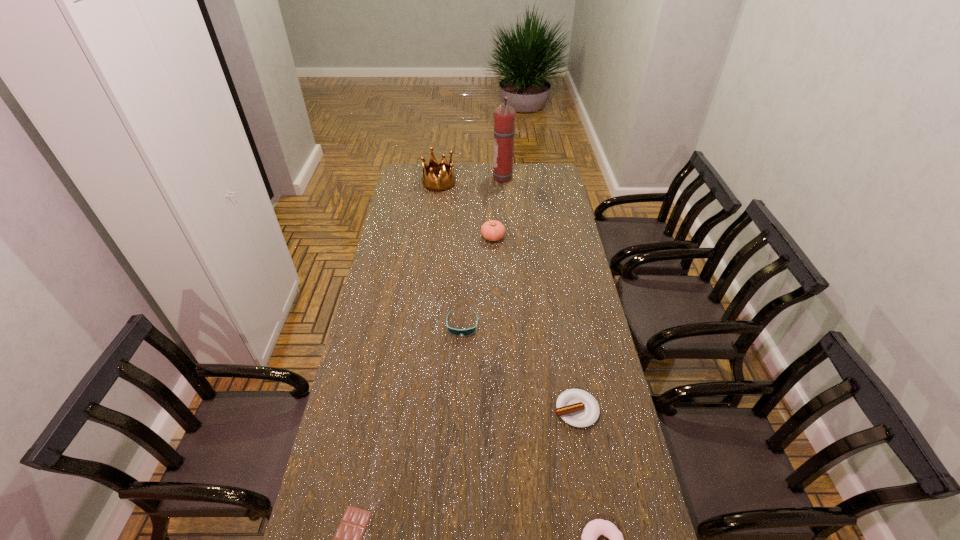
You are a GUI agent. You are given a task and a screenshot of the screen. Output one action in this format:
    pyautogui.click(x=<x>, y=<y>)
    Task: Click on the free region located on the right of the crown
    The height and width of the screenshot is (540, 960).
    Given the screenshot: What is the action you would take?
    pyautogui.click(x=526, y=183)

You are a GUI agent. You are given a task and a screenshot of the screen. Output one action in this format:
    pyautogui.click(x=<x>, y=<y>)
    Task: Click on the vacant space located on the front of the tomato
    
    Given the screenshot: What is the action you would take?
    pyautogui.click(x=495, y=305)

Find the location of a particular element. This screenshot has height=540, width=960. vacant area located 0.270m on the front-facing side of the sunglasses is located at coordinates (459, 404).

The image size is (960, 540). I want to click on free space located 0.170m on the back of the fifth farthest object, so click(x=565, y=349).

This screenshot has width=960, height=540. I want to click on fire extinguisher situated at the far edge, so click(504, 116).

Where is `crown present at the far edge`? The height and width of the screenshot is (540, 960). crown present at the far edge is located at coordinates (446, 180).

Where is `object located in the left edge section of the desktop`? Image resolution: width=960 pixels, height=540 pixels. object located in the left edge section of the desktop is located at coordinates (446, 180).

Find the location of a particular element. The image size is (960, 540). object that is at the right edge is located at coordinates tap(578, 408).

Locate an element on the screen. object present at the far left corner is located at coordinates (446, 180).

At what (x,y) coordinates should I click in order to perform the action: click on vacant space at the far edge of the desktop. Please return your answer as a coordinate pair (x, y). The width and height of the screenshot is (960, 540). Looking at the image, I should click on (477, 173).